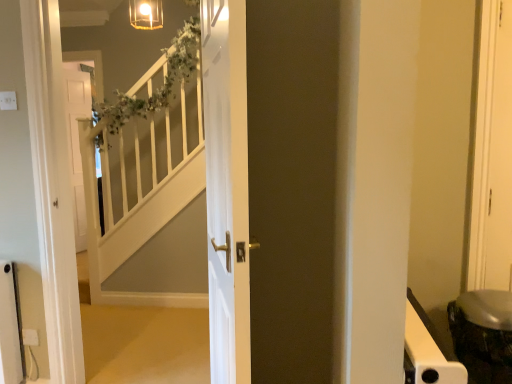
Describe the element at coordinates (30, 337) in the screenshot. I see `white plastic electric outlet at lower left` at that location.

I want to click on white plastic electric outlet at lower left, so click(x=30, y=337).

Where is `white glossy door at center`? Image resolution: width=512 pixels, height=384 pixels. white glossy door at center is located at coordinates (227, 187).

The width and height of the screenshot is (512, 384). What do you see at coordinates (227, 187) in the screenshot?
I see `white glossy door at center` at bounding box center [227, 187].

Find the location of a particular element. Image resolution: width=512 pixels, height=384 pixels. white plastic electric outlet at lower left is located at coordinates click(x=30, y=337).

In the scene shown: Is white plastic electric outlet at lower left to the left or to the right of white glossy door at center in the image?

white plastic electric outlet at lower left is positioned on white glossy door at center's left side.

Considering the relative positions of white plastic electric outlet at lower left and white glossy door at center in the image provided, is white plastic electric outlet at lower left behind white glossy door at center?

Yes, white plastic electric outlet at lower left is further from the viewer.

Which is further, (25, 330) or (220, 237)?

Point (25, 330)

From the image's perspective, relative to white glossy door at center, is white plastic electric outlet at lower left above or below?

Based on their image positions, white plastic electric outlet at lower left is located beneath white glossy door at center.

From a real-world perspective, is white plastic electric outlet at lower left under white glossy door at center?

Yes, from a real-world perspective, white plastic electric outlet at lower left is beneath white glossy door at center.

Which of these two, white plastic electric outlet at lower left or white glossy door at center, is thinner?

white plastic electric outlet at lower left is thinner.

In the scene shown: Is white plastic electric outlet at lower left taller than white glossy door at center?

In fact, white plastic electric outlet at lower left may be shorter than white glossy door at center.

In terms of size, does white plastic electric outlet at lower left appear bigger or smaller than white glossy door at center?

Clearly, white plastic electric outlet at lower left is smaller in size than white glossy door at center.

Is white plastic electric outlet at lower left not within white glossy door at center?

white plastic electric outlet at lower left lies outside white glossy door at center's area.

Is the surface of white plastic electric outlet at lower left in direct contact with white glossy door at center?

white plastic electric outlet at lower left and white glossy door at center are clearly separated.

Is white plastic electric outlet at lower left turned away from white glossy door at center?

No, white plastic electric outlet at lower left's orientation is not away from white glossy door at center.

What's the angular difference between white plastic electric outlet at lower left and white glossy door at center's facing directions?

The facing directions of white plastic electric outlet at lower left and white glossy door at center are 74.1 degrees apart.

Find the location of `electric outlet below the white glossy door at center (from the image's perspective)`. electric outlet below the white glossy door at center (from the image's perspective) is located at coordinates (30, 337).

Is white glossy door at center to the right of white plastic electric outlet at lower left from the viewer's perspective?

Correct, you'll find white glossy door at center to the right of white plastic electric outlet at lower left.

Is white glossy door at center positioned before white plastic electric outlet at lower left?

Yes, the depth of white glossy door at center is less than that of white plastic electric outlet at lower left.

Is point (247, 247) positioned after point (32, 345)?

That is False.

From the image's perspective, is white glossy door at center above or below white plastic electric outlet at lower left?

From the image's perspective, white glossy door at center appears above white plastic electric outlet at lower left.

From a real-world perspective, does white glossy door at center stand above white plastic electric outlet at lower left?

Correct, in the physical world, white glossy door at center is higher than white plastic electric outlet at lower left.

Based on the photo, can you confirm if white glossy door at center is wider than white plastic electric outlet at lower left?

Yes.

Is white glossy door at center taller or shorter than white plastic electric outlet at lower left?

In the image, white glossy door at center appears to be taller than white plastic electric outlet at lower left.

In the scene shown: Between white glossy door at center and white plastic electric outlet at lower left, which one has larger size?

Bigger between the two is white glossy door at center.

Is white glossy door at center not inside white plastic electric outlet at lower left?

Yes, white glossy door at center is not within white plastic electric outlet at lower left.

Would you say white glossy door at center is a long distance from white plastic electric outlet at lower left?

Yes, white glossy door at center and white plastic electric outlet at lower left are quite far apart.

Is white glossy door at center looking in the opposite direction of white plastic electric outlet at lower left?

No, white glossy door at center's orientation is not away from white plastic electric outlet at lower left.

How many degrees apart are the facing directions of white glossy door at center and white plastic electric outlet at lower left?

There is a 74.1-degree angle between the facing directions of white glossy door at center and white plastic electric outlet at lower left.

Find the location of a particular element. The width and height of the screenshot is (512, 384). door that is above the white plastic electric outlet at lower left (from a real-world perspective) is located at coordinates (227, 187).

The image size is (512, 384). Identify the location of electric outlet on the left side of white glossy door at center. (30, 337).

I want to click on door that appears above the white plastic electric outlet at lower left (from a real-world perspective), so pos(227,187).